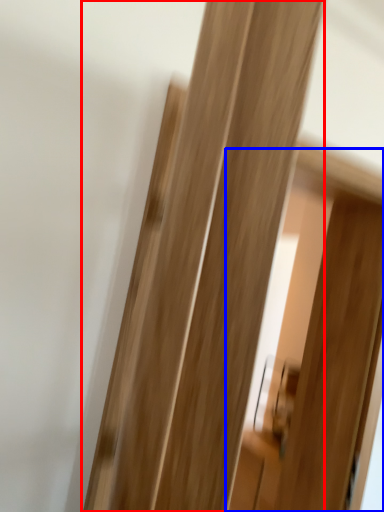
Question: Which point is further to the camera, door (highlighted by a red box) or screen door (highlighted by a blue box)?

Choices:
 (A) door
 (B) screen door

Answer: (B)